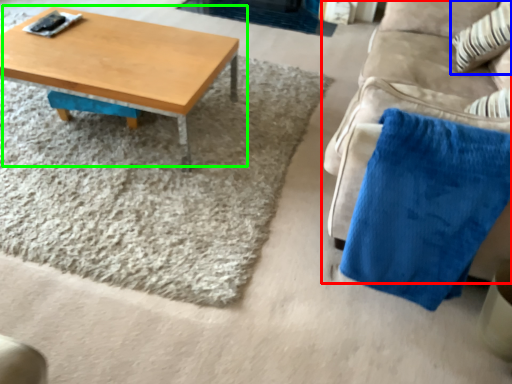
Question: Which object is positioned farthest from studio couch (highlighted by a red box)? Select from throw pillow (highlighted by a blue box) and coffee table (highlighted by a green box).

Choices:
 (A) throw pillow
 (B) coffee table

Answer: (B)